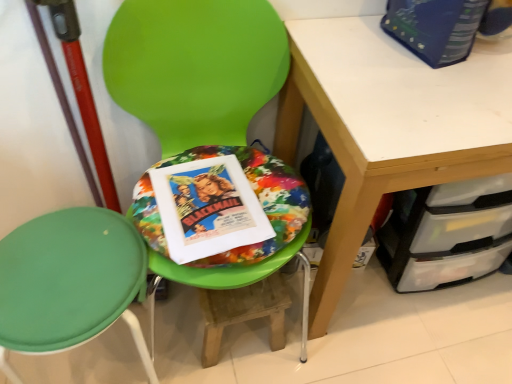
Locate an element on the screen. The height and width of the screenshot is (384, 512). free space above white matte desk at upper right (from a real-world perspective) is located at coordinates (433, 71).